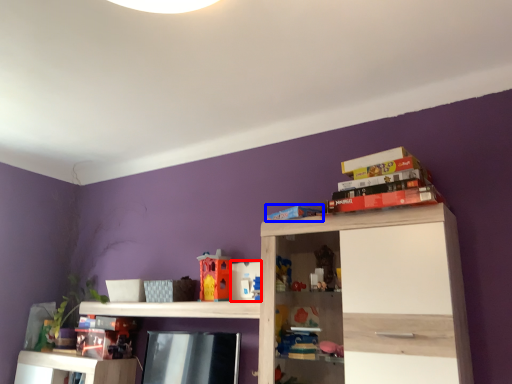
Question: Which of the following is the farthest to the observer, toy (highlighted by a red box) or book (highlighted by a blue box)?

Choices:
 (A) toy
 (B) book

Answer: (A)